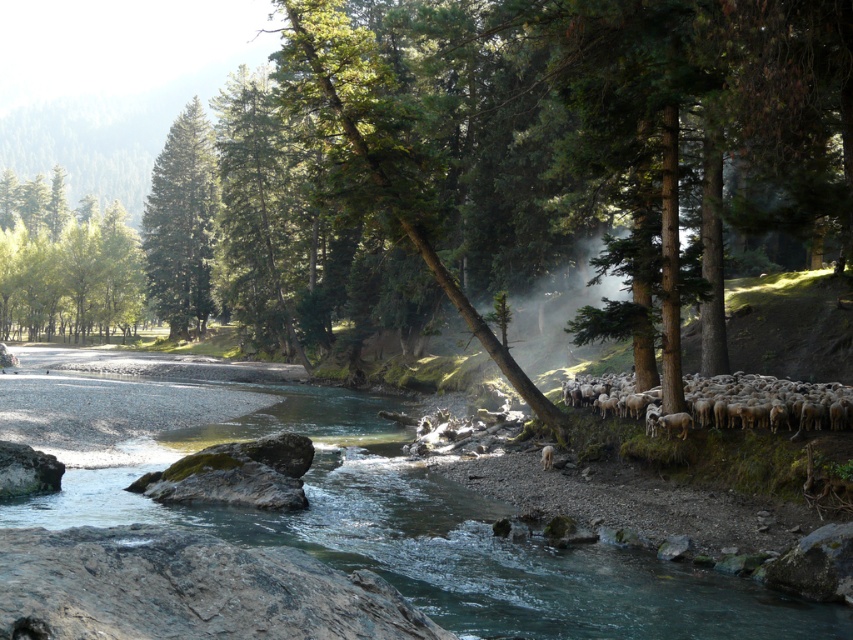
In the scene shown: Is clear water at river right smaller than green matte tree at upper left?

Indeed, clear water at river right has a smaller size compared to green matte tree at upper left.

Who is higher up, clear water at river right or green matte tree at upper left?

green matte tree at upper left is above.

Where is `clear water at river right`? This screenshot has width=853, height=640. clear water at river right is located at coordinates (358, 504).

Identify the location of clear water at river right. (358, 504).

Does green leafy tree at upper left appear over white woolly sheep at right?

Yes.

This screenshot has width=853, height=640. Identify the location of green leafy tree at upper left. (64, 262).

Describe the element at coordinates (64, 262) in the screenshot. I see `green leafy tree at upper left` at that location.

Measure the distance between point [94,212] and camera.

Point [94,212] and camera are 156.13 meters apart from each other.

I want to click on green leafy tree at upper left, so click(x=64, y=262).

The image size is (853, 640). What are the coordinates of `green leafy tree at upper left` in the screenshot? It's located at (64, 262).